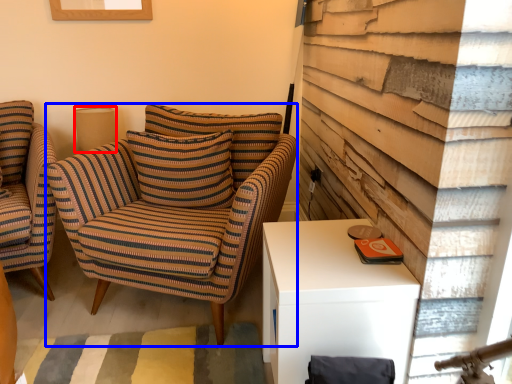
Question: Which of the following is the farthest to the observer, lamp (highlighted by a red box) or chair (highlighted by a blue box)?

Choices:
 (A) lamp
 (B) chair

Answer: (A)